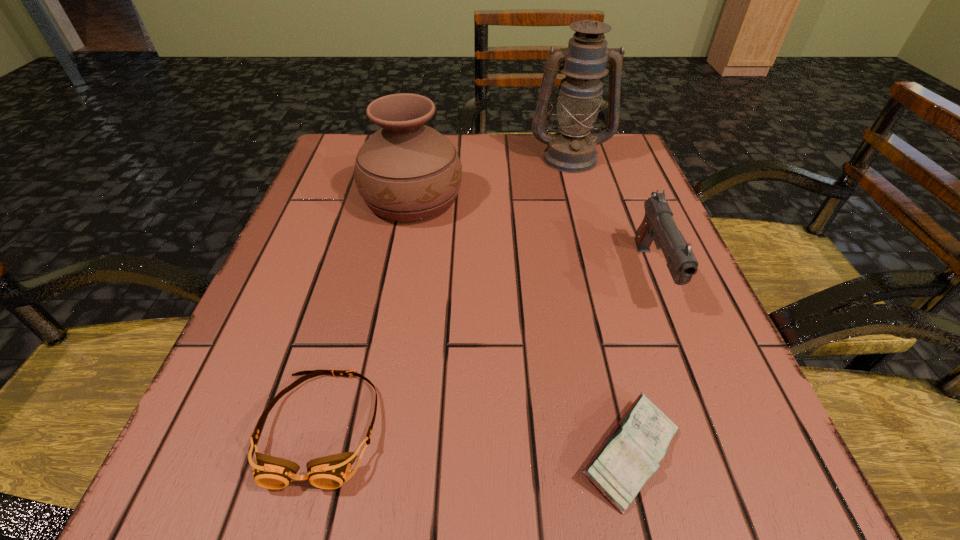
At what (x,y) coordinates should I click in order to perform the action: click on blank space that satisfies the following two spatial constraints: 1. on the back side of the second tallest object; 2. on the left side of the oil lamp. Please return your answer as a coordinate pair (x, y). Looking at the image, I should click on (420, 157).

Identify the location of vacant area in the image that satisfies the following two spatial constraints: 1. on the front side of the fourth shortest object; 2. on the left side of the diary. The height and width of the screenshot is (540, 960). (365, 454).